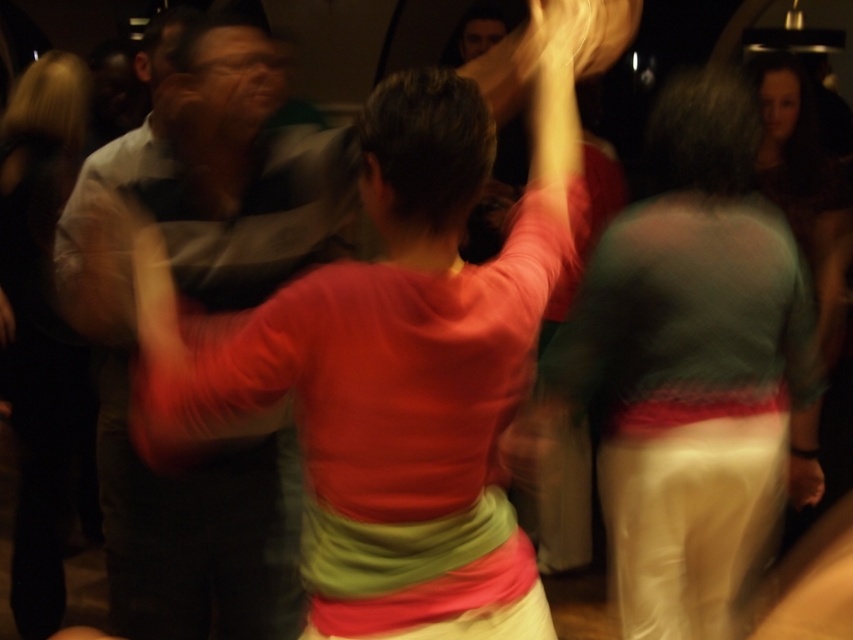
You are at a party and see two people wearing sweaters. One has a matte green sweater at center and the other has a matte red sweater at center. Which one is standing to the right of the other?

The matte green sweater at center is positioned on the right side of the matte red sweater at center.

You are at a party and want to find the matte green sweater at center and the striped cotton shirt at center. Which one is positioned to the right side of the other?

The matte green sweater at center is to the right of the striped cotton shirt at center.